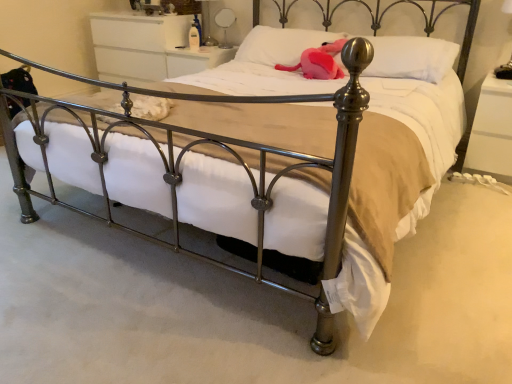
Question: Is pink plush toy at center positioned in front of white soft pillow at upper center, which is counted as the 2th pillow, starting from the right?

Choices:
 (A) no
 (B) yes

Answer: (B)

Question: From the image's perspective, is pink plush toy at center located beneath white soft pillow at upper center, acting as the 1th pillow starting from the left?

Choices:
 (A) yes
 (B) no

Answer: (A)

Question: Considering the relative sizes of pink plush toy at center and white soft pillow at upper center, acting as the 1th pillow starting from the left, in the image provided, is pink plush toy at center shorter than white soft pillow at upper center, acting as the 1th pillow starting from the left,?

Choices:
 (A) no
 (B) yes

Answer: (B)

Question: Can you confirm if pink plush toy at center is wider than white soft pillow at upper center, which is counted as the 2th pillow, starting from the right?

Choices:
 (A) yes
 (B) no

Answer: (A)

Question: From the image's perspective, is pink plush toy at center located above white soft pillow at upper center, which is counted as the 2th pillow, starting from the right?

Choices:
 (A) yes
 (B) no

Answer: (B)

Question: Considering the relative positions of pink plush toy at center and white soft pillow at upper center, acting as the 1th pillow starting from the left, in the image provided, is pink plush toy at center to the right of white soft pillow at upper center, acting as the 1th pillow starting from the left, from the viewer's perspective?

Choices:
 (A) no
 (B) yes

Answer: (B)

Question: From the image's perspective, is white soft pillow at upper center, which is counted as the second pillow, starting from the left, over white glossy dresser at upper center, acting as the 1th nightstand starting from the top?

Choices:
 (A) yes
 (B) no

Answer: (B)

Question: Could white glossy dresser at upper center, which is the 2th nightstand from right to left, be considered to be inside white soft pillow at upper center, which is counted as the second pillow, starting from the left?

Choices:
 (A) no
 (B) yes

Answer: (A)

Question: Could you tell me if white soft pillow at upper center, which is counted as the second pillow, starting from the left, is facing white glossy dresser at upper center, which appears as the second nightstand when viewed from the front?

Choices:
 (A) yes
 (B) no

Answer: (B)

Question: Considering the relative sizes of white soft pillow at upper center, which is counted as the second pillow, starting from the left, and white glossy dresser at upper center, positioned as the 1th nightstand in left-to-right order, in the image provided, is white soft pillow at upper center, which is counted as the second pillow, starting from the left, shorter than white glossy dresser at upper center, positioned as the 1th nightstand in left-to-right order,?

Choices:
 (A) yes
 (B) no

Answer: (A)

Question: Can you confirm if white soft pillow at upper center, which is counted as the second pillow, starting from the left, is smaller than white glossy dresser at upper center, positioned as the 1th nightstand in left-to-right order?

Choices:
 (A) no
 (B) yes

Answer: (B)

Question: From the image's perspective, would you say white soft pillow at upper center, the 1th pillow from the right, is shown under white glossy dresser at upper center, positioned as the 1th nightstand in left-to-right order?

Choices:
 (A) yes
 (B) no

Answer: (A)

Question: Is metallic silver table lamp at upper center, positioned as the 2th table lamp in right-to-left order, facing towards metallic silver table lamp at upper right, which ranks as the first table lamp in bottom-to-top order?

Choices:
 (A) no
 (B) yes

Answer: (A)